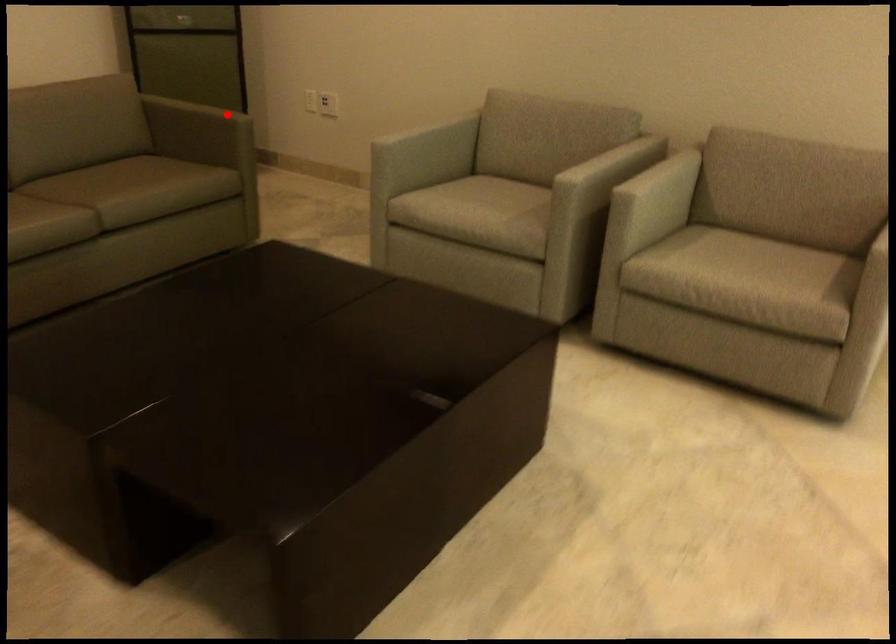
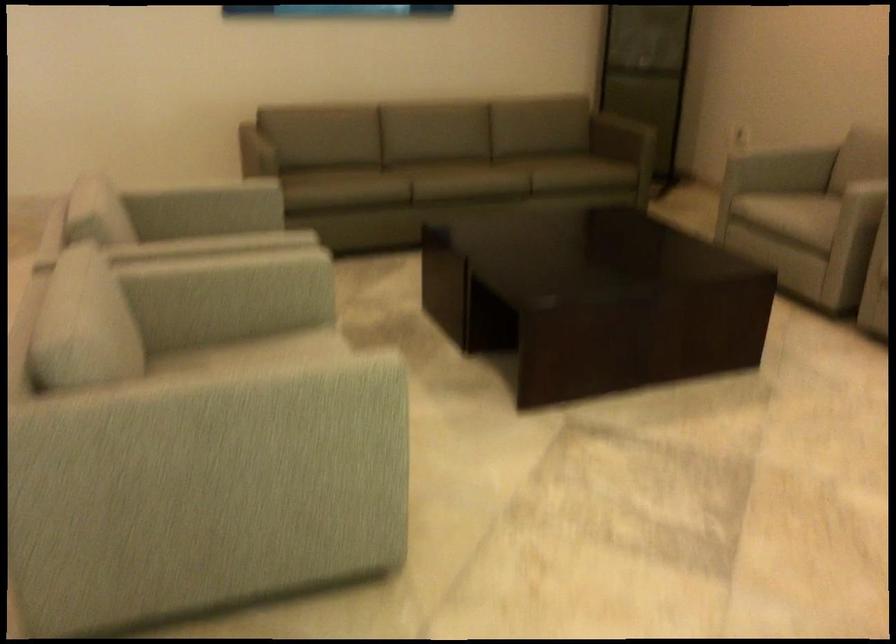
Question: I am providing you with two images of the same scene from different viewpoints. A red point is shown in image1. For the corresponding object point in image2, is it positioned nearer or farther from the camera?

Choices:
 (A) Nearer
 (B) Farther

Answer: (B)